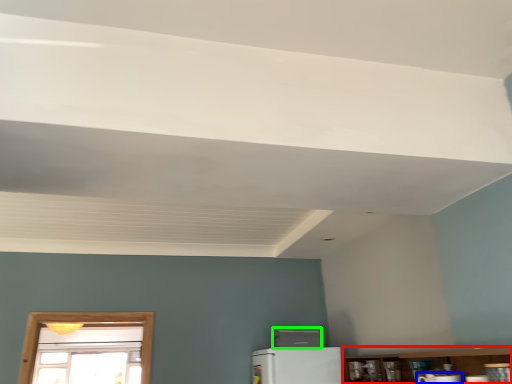
Question: Estimate the real-world distances between objects in this image. Which object is closer to shelf (highlighted by a red box), appliance (highlighted by a blue box) or appliance (highlighted by a green box)?

Choices:
 (A) appliance
 (B) appliance

Answer: (B)